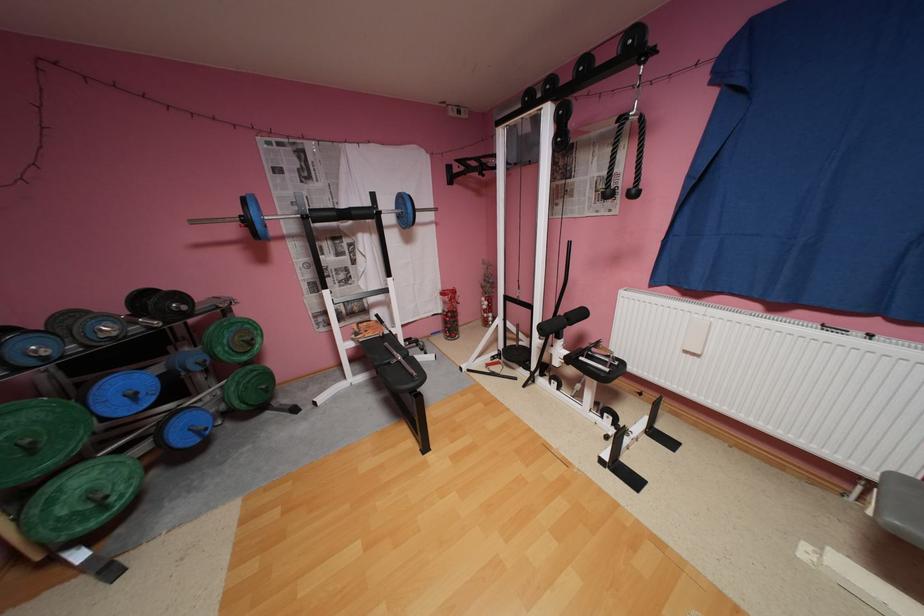
Find where to push the padded leg roller. Please return your answer as a coordinate pair (x, y).

(396, 375)